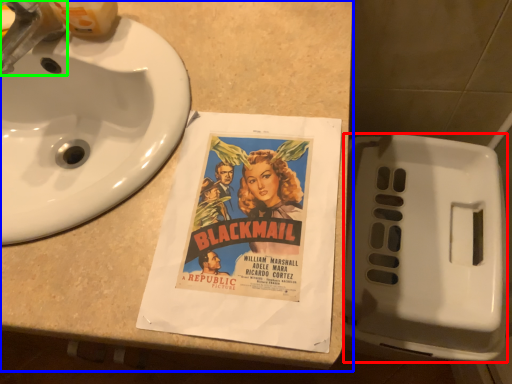
Question: Which object is the closest to the toilet (highlighted by a red box)? Choose among these: counter top (highlighted by a blue box) or faucet (highlighted by a green box).

Choices:
 (A) counter top
 (B) faucet

Answer: (A)